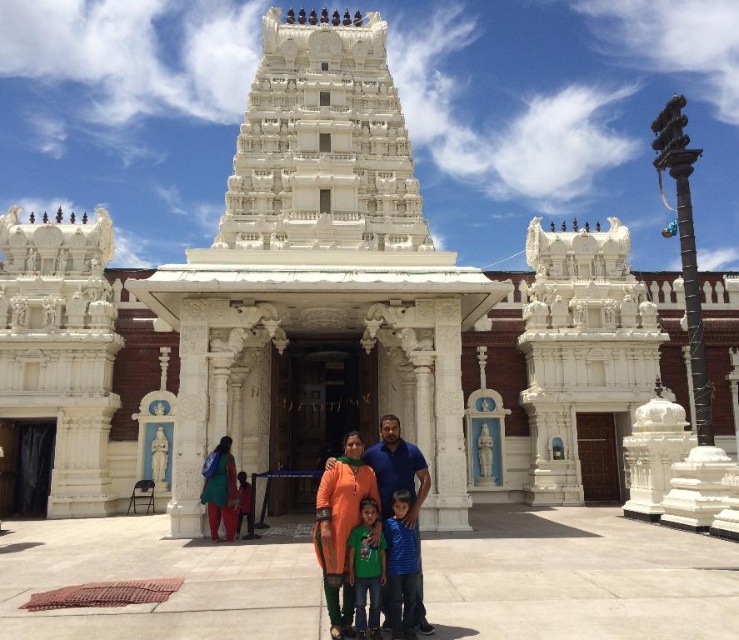
You are standing in front of the temple and want to place a small offering at the point closer to you between point [415,456] and point [236,529]. Which point should you choose?

Point [415,456] is in front of point [236,529], so you should choose point [415,456] to place the offering as it is closer to you.